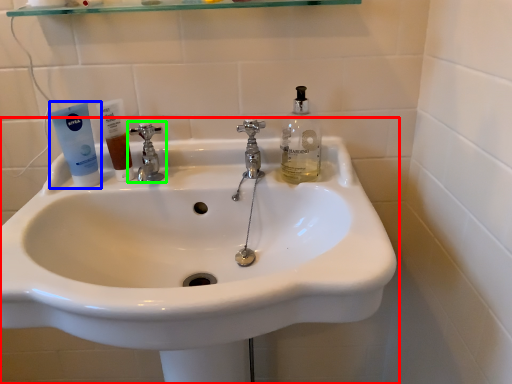
Question: Considering the real-world distances, which object is closest to sink (highlighted by a red box)? toothpaste (highlighted by a blue box) or tap (highlighted by a green box).

Choices:
 (A) toothpaste
 (B) tap

Answer: (B)